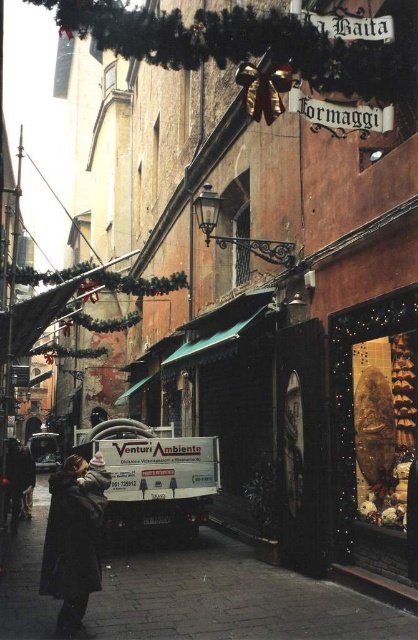
Question: Considering the relative positions of white matte van at center and dark brown coat at lower left in the image provided, where is white matte van at center located with respect to dark brown coat at lower left?

Choices:
 (A) above
 (B) below

Answer: (B)

Question: Which of the following is the closest to the observer?

Choices:
 (A) pos(56,474)
 (B) pos(186,636)

Answer: (B)

Question: Is white matte van at center closer to the viewer compared to dark brown coat at lower left?

Choices:
 (A) no
 (B) yes

Answer: (A)

Question: Considering the relative positions of white matte van at center and dark brown coat at lower left in the image provided, where is white matte van at center located with respect to dark brown coat at lower left?

Choices:
 (A) left
 (B) right

Answer: (A)